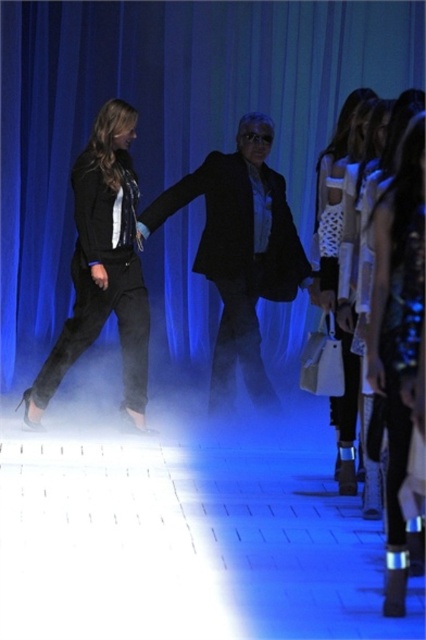
Question: Is matte black suit at center closer to the viewer compared to black matte blazer at left?

Choices:
 (A) no
 (B) yes

Answer: (A)

Question: Where is matte black suit at center located in relation to white textured sweater at center in the image?

Choices:
 (A) left
 (B) right

Answer: (A)

Question: Which is farther from the black matte blazer at left?

Choices:
 (A) white textured sweater at center
 (B) metallic silver boots at lower right
 (C) matte black suit at center

Answer: (B)

Question: Which point appears farthest from the camera in this image?

Choices:
 (A) (380, 371)
 (B) (224, 250)
 (C) (34, 403)

Answer: (B)

Question: Considering the real-world distances, which object is farthest from the white textured sweater at center?

Choices:
 (A) matte black suit at center
 (B) metallic silver boots at lower right

Answer: (B)

Question: From the image, what is the correct spatial relationship of matte black suit at center in relation to white textured sweater at center?

Choices:
 (A) above
 (B) below

Answer: (A)